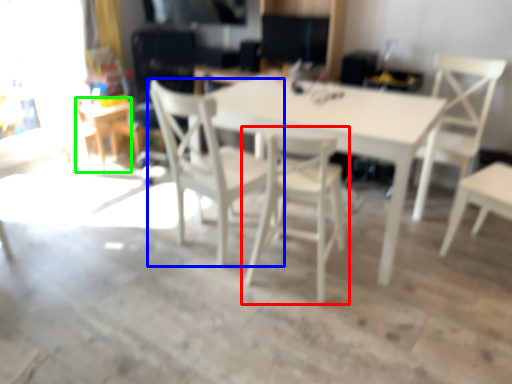
Question: Based on their relative distances, which object is farther from chair (highlighted by a red box)? Choose from chair (highlighted by a blue box) and table (highlighted by a green box).

Choices:
 (A) chair
 (B) table

Answer: (B)